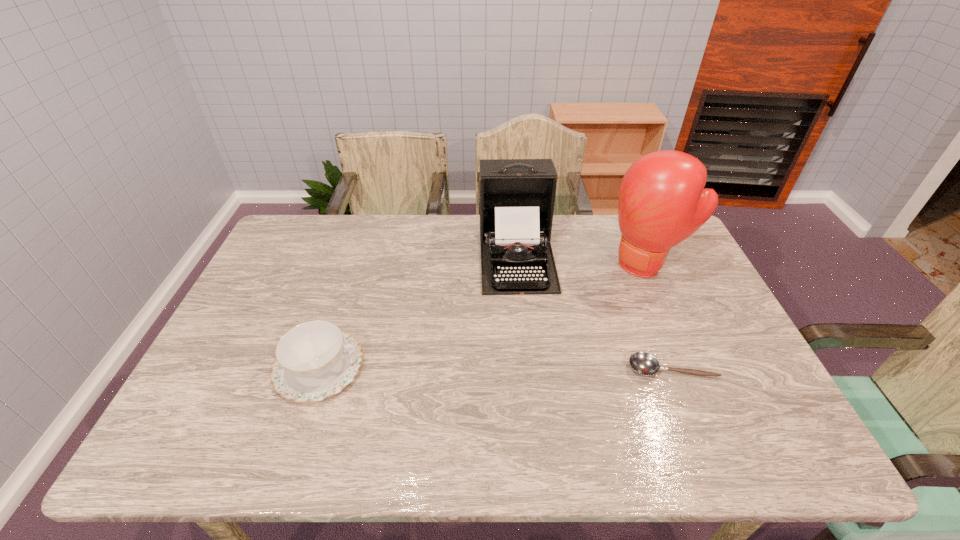
The image size is (960, 540). Find the location of `free space at the far edge of the desktop`. free space at the far edge of the desktop is located at coordinates (613, 256).

Where is `blank space at the near edge of the desktop`? This screenshot has width=960, height=540. blank space at the near edge of the desktop is located at coordinates (411, 410).

The image size is (960, 540). I want to click on free space at the left edge of the desktop, so click(x=267, y=270).

This screenshot has height=540, width=960. Identify the location of vacant space at the right edge. (693, 364).

In the image, there is a desktop. Identify the location of vacant space at the far left corner. (312, 250).

Locate an element on the screen. vacant region between the shortest object and the second object from left to right is located at coordinates (594, 311).

Locate an element on the screen. vacant space in between the tallest object and the shortest object is located at coordinates point(660,316).

At what (x,y) coordinates should I click in order to perform the action: click on vacant area between the boxing glove and the second shortest object. Please return your answer as a coordinate pair (x, y). This screenshot has width=960, height=540. Looking at the image, I should click on (483, 316).

Locate an element on the screen. vacant space that's between the typewriter and the leftmost object is located at coordinates (418, 310).

At what (x,y) coordinates should I click in order to perform the action: click on blank region between the shortest object and the typewriter. Please return your answer as a coordinate pair (x, y). Looking at the image, I should click on (594, 311).